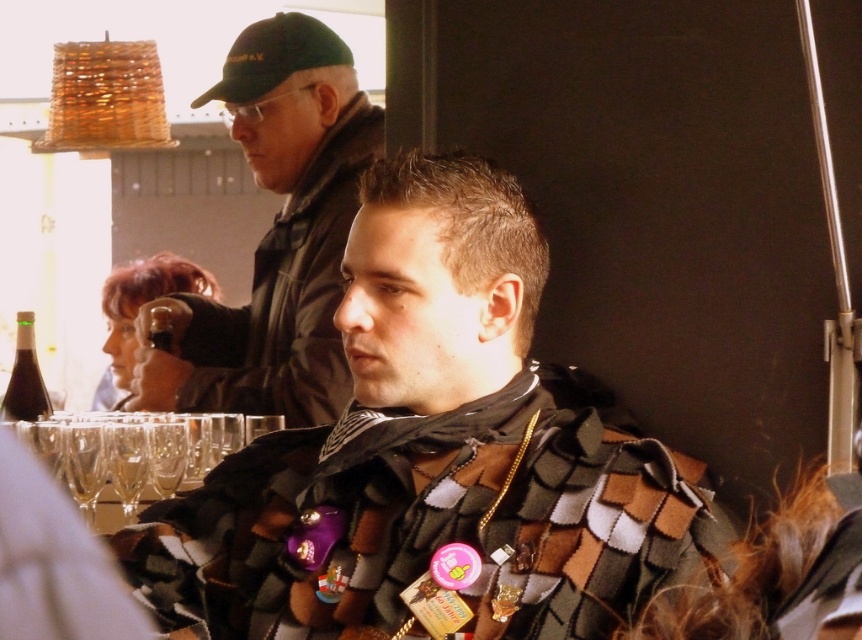
Does textured wool scarf at center appear over green fabric baseball cap at upper left?

No.

Does textured wool scarf at center come behind green fabric baseball cap at upper left?

That is False.

Where is `textured wool scarf at center`? Image resolution: width=862 pixels, height=640 pixels. textured wool scarf at center is located at coordinates (432, 456).

Identify the location of textured wool scarf at center. The height and width of the screenshot is (640, 862). (432, 456).

Is clear glass wine glass at lower left taller than green fabric baseball cap at upper left?

No, clear glass wine glass at lower left is not taller than green fabric baseball cap at upper left.

Is clear glass wine glass at lower left to the right of green fabric baseball cap at upper left from the viewer's perspective?

Correct, you'll find clear glass wine glass at lower left to the right of green fabric baseball cap at upper left.

At what (x,y) coordinates should I click in order to perform the action: click on clear glass wine glass at lower left. Please return your answer as a coordinate pair (x, y). Looking at the image, I should click on (134, 454).

Is dark green cap at upper left above clear glass wine glass at lower left?

Indeed, dark green cap at upper left is positioned over clear glass wine glass at lower left.

Does dark green cap at upper left appear on the left side of clear glass wine glass at lower left?

Incorrect, dark green cap at upper left is not on the left side of clear glass wine glass at lower left.

Find the location of a particular element. The image size is (862, 640). dark green cap at upper left is located at coordinates (275, 236).